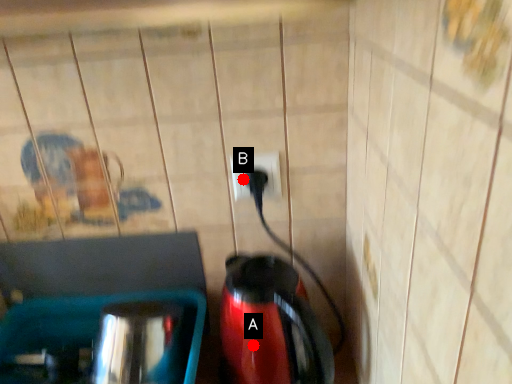
Question: Two points are circled on the image, labeled by A and B beside each circle. Which point is farther from the camera taking this photo?

Choices:
 (A) A is further
 (B) B is further

Answer: (B)